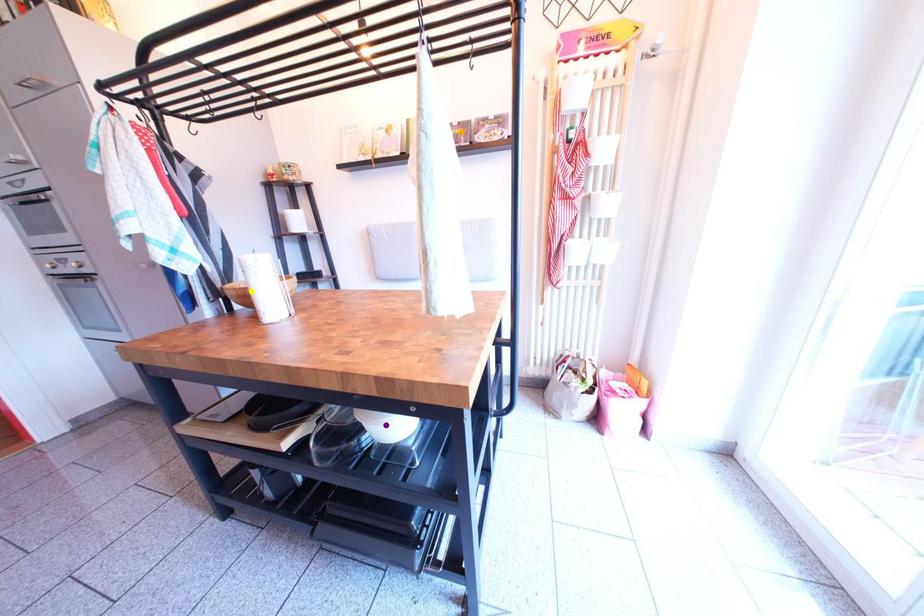
Looking at this image, order these from nearest to farthest:
yellow point, orange point, purple point

purple point
orange point
yellow point